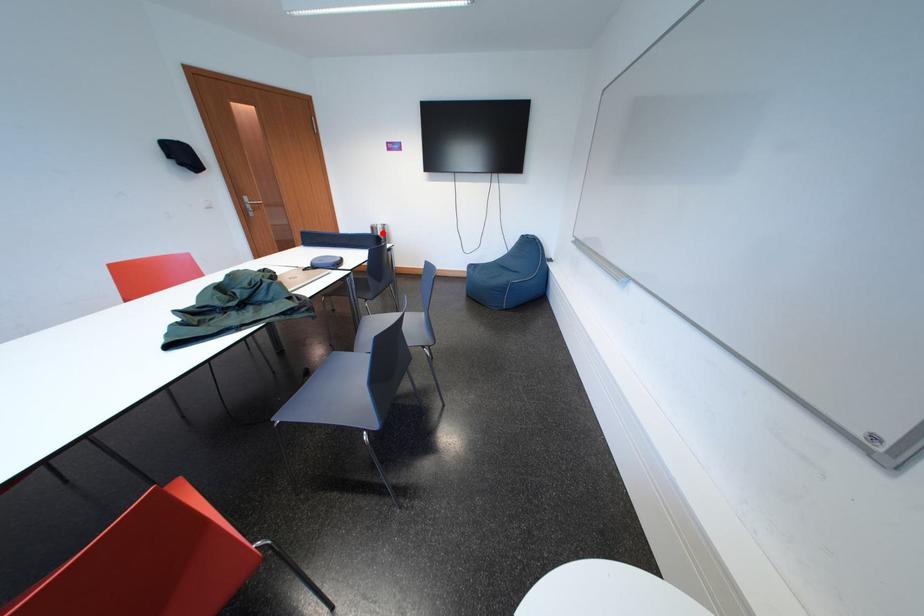
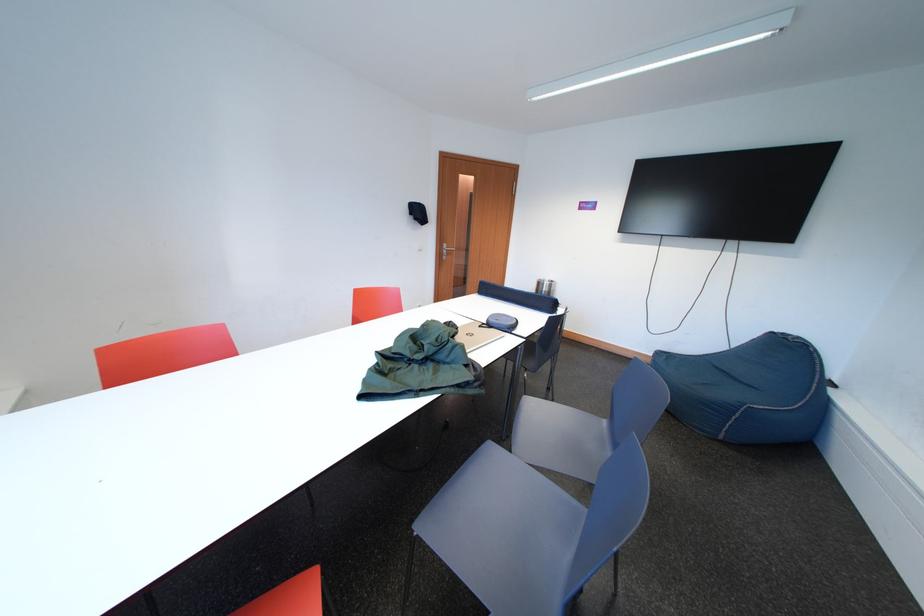
Question: I am providing you with two images of the same scene from different viewpoints. Image1 has a red point marked. In image2, the corresponding 3D location appears at what relative position? Reply with the corresponding letter.

Choices:
 (A) Closer
 (B) Farther

Answer: (A)